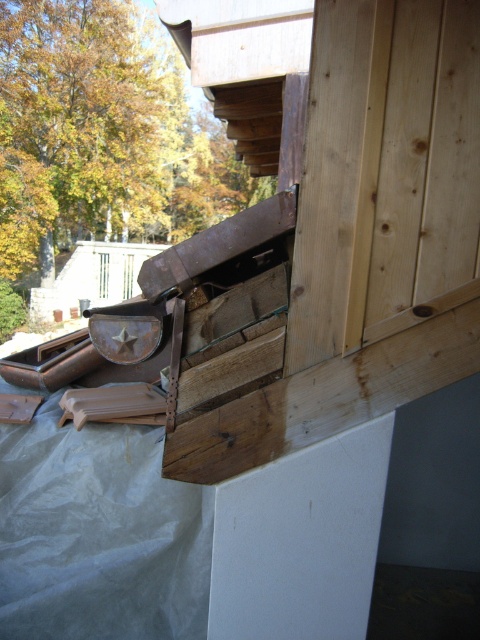
You are an inspector checking the wooden structure. You notice two points labeled as point 1 and point 2. Point 1 is at coordinates (108, 276) and point 2 is at (132, 291). Based on your observation, which point is closer to you?

Point 1 at coordinates (108, 276) is closer to the camera than point 2 at (132, 291).

You are an architect designing a new building and need to ensure that the brown wood window at upper center and the transparent glass window at upper center are proportionally balanced. Given their widths, which window should be placed in a position where a narrower frame is required?

The brown wood window at upper center should be placed where a narrower frame is required because its width is less than the transparent glass window at upper center.